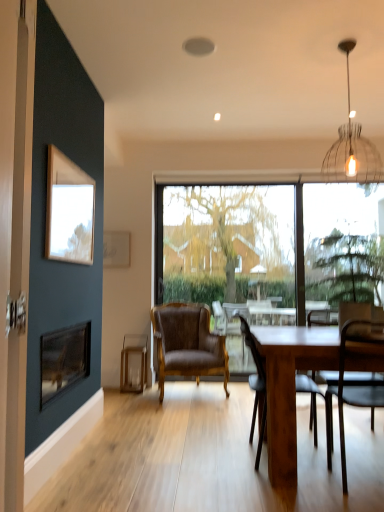
Image resolution: width=384 pixels, height=512 pixels. What do you see at coordinates (116, 249) in the screenshot?
I see `white paper at upper left, positioned as the first picture frame in back-to-front order` at bounding box center [116, 249].

Image resolution: width=384 pixels, height=512 pixels. What do you see at coordinates (15, 231) in the screenshot? I see `matte glass screen door at left` at bounding box center [15, 231].

The width and height of the screenshot is (384, 512). Find the location of `metallic dark brown chair at right, which is the third chair in left-to-right order`. metallic dark brown chair at right, which is the third chair in left-to-right order is located at coordinates (354, 380).

What do you see at coordinates (354, 380) in the screenshot? The height and width of the screenshot is (512, 384). I see `metallic dark brown chair at right, marked as the 1th chair in a right-to-left arrangement` at bounding box center [354, 380].

Where is `black glass fireplace at left`? Image resolution: width=384 pixels, height=512 pixels. black glass fireplace at left is located at coordinates (63, 359).

Describe the element at coordinates (132, 362) in the screenshot. I see `clear glass candlestick at lower center` at that location.

Find the location of a particular element. The image size is (384, 512). white paper at upper left, which is the 2th picture frame in front-to-back order is located at coordinates (116, 249).

From the image's perspective, is clear glass candlestick at lower center located above or below green leafy tree at center, which is the first tree from front to back?

clear glass candlestick at lower center is below green leafy tree at center, which is the first tree from front to back.

Is clear glass candlestick at lower center taller or shorter than green leafy tree at center, which is the first tree from front to back?

clear glass candlestick at lower center is shorter than green leafy tree at center, which is the first tree from front to back.

Is clear glass candlestick at lower center aimed at green leafy tree at center, the 2th tree when ordered from back to front?

No.

I want to click on plank that appears below the green leafy tree at center, the 2th tree when ordered from back to front (from the image's perspective), so click(x=132, y=362).

Is metallic dark brown chair at right, arranged as the 1th chair when viewed from the front, in front of black glass fireplace at left?

Yes.

Based on the photo, considering the sizes of objects metallic dark brown chair at right, marked as the 1th chair in a right-to-left arrangement, and black glass fireplace at left in the image provided, who is smaller, metallic dark brown chair at right, marked as the 1th chair in a right-to-left arrangement, or black glass fireplace at left?

black glass fireplace at left is smaller.

In terms of width, does metallic dark brown chair at right, arranged as the 1th chair when viewed from the front, look wider or thinner when compared to black glass fireplace at left?

In the image, metallic dark brown chair at right, arranged as the 1th chair when viewed from the front, appears to be wider than black glass fireplace at left.

Is metallic dark brown chair at right, the 3th chair when ordered from back to front, at the left side of black glass fireplace at left?

In fact, metallic dark brown chair at right, the 3th chair when ordered from back to front, is to the right of black glass fireplace at left.

Identify the location of plank below the white paper at upper left, which is the 2th picture frame in front-to-back order (from the image's perspective). The width and height of the screenshot is (384, 512). (132, 362).

Between point (110, 263) and point (122, 367), which one is positioned in front?

Positioned in front is point (122, 367).

Does white paper at upper left, which is the 2th picture frame in front-to-back order, have a smaller size compared to clear glass candlestick at lower center?

Yes, white paper at upper left, which is the 2th picture frame in front-to-back order, is smaller than clear glass candlestick at lower center.

Which of these two, white paper at upper left, positioned as the first picture frame in back-to-front order, or clear glass candlestick at lower center, is thinner?

Thinner between the two is white paper at upper left, positioned as the first picture frame in back-to-front order.

Consider the image. Would you say clear glass candlestick at lower center is inside or outside black glass fireplace at left?

clear glass candlestick at lower center is outside black glass fireplace at left.

From the picture: Is clear glass candlestick at lower center closer to camera compared to black glass fireplace at left?

That is False.

From the image's perspective, which one is positioned higher, clear glass candlestick at lower center or black glass fireplace at left?

black glass fireplace at left is shown above in the image.

From their relative heights in the image, would you say clear glass candlestick at lower center is taller or shorter than black glass fireplace at left?

In the image, clear glass candlestick at lower center appears to be taller than black glass fireplace at left.

Is metallic wire pendant light at upper right positioned with its back to wooden table at center?

No, wooden table at center is not at the back of metallic wire pendant light at upper right.

From a real-world perspective, who is located lower, metallic wire pendant light at upper right or wooden table at center?

wooden table at center.

From the image's perspective, between metallic wire pendant light at upper right and wooden table at center, which one is located above?

metallic wire pendant light at upper right, from the image's perspective.

Is clear glass candlestick at lower center in front of white paper at upper left, which is the 2th picture frame in front-to-back order?

That is True.

Is clear glass candlestick at lower center shorter than white paper at upper left, which is the 2th picture frame in front-to-back order?

No.

What's the angular difference between clear glass candlestick at lower center and white paper at upper left, which is the 2th picture frame in front-to-back order,'s facing directions?

The facing directions of clear glass candlestick at lower center and white paper at upper left, which is the 2th picture frame in front-to-back order, are 2.18 degrees apart.

I want to click on picture frame that is the 2nd object to the left of the clear glass candlestick at lower center, starting at the anchor, so click(116, 249).

Can you confirm if black glass fireplace at left is positioned to the right of white paper at upper left, which is the 2th picture frame in front-to-back order?

Incorrect, black glass fireplace at left is not on the right side of white paper at upper left, which is the 2th picture frame in front-to-back order.

From the image's perspective, is black glass fireplace at left positioned above or below white paper at upper left, which is the 2th picture frame in front-to-back order?

Based on their image positions, black glass fireplace at left is located beneath white paper at upper left, which is the 2th picture frame in front-to-back order.

Is white paper at upper left, positioned as the first picture frame in back-to-front order, at the back of black glass fireplace at left?

black glass fireplace at left does not have its back to white paper at upper left, positioned as the first picture frame in back-to-front order.

Which is behind, black glass fireplace at left or white paper at upper left, positioned as the first picture frame in back-to-front order?

white paper at upper left, positioned as the first picture frame in back-to-front order, is further away from the camera.

Where is `plank on the left of green leafy tree at center, which is the first tree from front to back`? Image resolution: width=384 pixels, height=512 pixels. plank on the left of green leafy tree at center, which is the first tree from front to back is located at coordinates click(x=132, y=362).

In order to click on the 3rd chair to the right of the black glass fireplace at left, starting your count from the anchor in this screenshot , I will do `click(354, 380)`.

Looking at the image, which one is located further to brown leather chair at center, the third chair viewed from the front, wooden table at center or green leafy tree at center, the second tree viewed from the front?

Based on the image, wooden table at center appears to be further to brown leather chair at center, the third chair viewed from the front.

Considering their positions, is transparent glass window at center positioned further to white paper at upper left, which is the 2th picture frame in front-to-back order, than wooden picture frame at upper left, the first picture frame positioned from the front?

The object further to white paper at upper left, which is the 2th picture frame in front-to-back order, is wooden picture frame at upper left, the first picture frame positioned from the front.

From the image, which object appears to be farther from wooden chair at center, which is counted as the 2th chair, starting from the front, brown leather chair at center, positioned as the third chair in right-to-left order, or metallic dark brown chair at right, which is the third chair in left-to-right order?

Among the two, brown leather chair at center, positioned as the third chair in right-to-left order, is located further to wooden chair at center, which is counted as the 2th chair, starting from the front.

When comparing their distances from matte glass screen door at left, does white paper at upper left, positioned as the first picture frame in back-to-front order, or green leafy tree at center, the 2th tree when ordered from back to front, seem closer?

Among the two, green leafy tree at center, the 2th tree when ordered from back to front, is located nearer to matte glass screen door at left.

Based on their spatial positions, is metallic dark brown chair at right, which is the third chair in left-to-right order, or white paper at upper left, positioned as the first picture frame in back-to-front order, closer to wooden chair at center, the 2th chair positioned from the back?

metallic dark brown chair at right, which is the third chair in left-to-right order, is closer to wooden chair at center, the 2th chair positioned from the back.

Looking at the image, which one is located closer to white paper at upper left, positioned as the first picture frame in back-to-front order, green leafy tree at center, the second tree viewed from the front, or clear glass candlestick at lower center?

The object closer to white paper at upper left, positioned as the first picture frame in back-to-front order, is clear glass candlestick at lower center.

When comparing their distances from wooden picture frame at upper left, which appears as the second picture frame when viewed from the back, does clear glass candlestick at lower center or wooden table at center seem closer?

wooden table at center is closer to wooden picture frame at upper left, which appears as the second picture frame when viewed from the back.

Based on their spatial positions, is green leafy tree at center, which is the first tree from front to back, or clear glass candlestick at lower center further from black glass fireplace at left?

The object further to black glass fireplace at left is green leafy tree at center, which is the first tree from front to back.

This screenshot has width=384, height=512. I want to click on lamp located between green leafy tree at center, the 2th tree when ordered from back to front, and green leafy tree at center, arranged as the first tree when viewed from the back, in the depth direction, so click(x=351, y=146).

Image resolution: width=384 pixels, height=512 pixels. I want to click on tree between black glass fireplace at left and white paper at upper left, positioned as the first picture frame in back-to-front order, along the z-axis, so coord(346,267).

Where is `window between wooden chair at center, the 2th chair positioned from the back, and green leafy tree at center, arranged as the first tree when viewed from the back, along the z-axis`? The width and height of the screenshot is (384, 512). window between wooden chair at center, the 2th chair positioned from the back, and green leafy tree at center, arranged as the first tree when viewed from the back, along the z-axis is located at coordinates (269, 250).

Identify the location of plank located between metallic dark brown chair at right, arranged as the 1th chair when viewed from the front, and green leafy tree at center, arranged as the first tree when viewed from the back, in the depth direction. This screenshot has width=384, height=512. (132, 362).